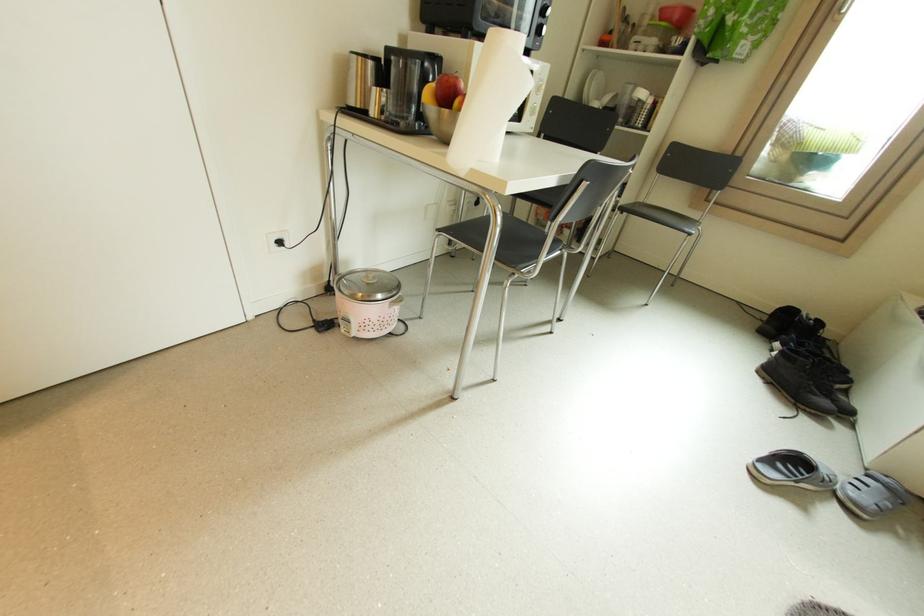
The width and height of the screenshot is (924, 616). I want to click on white power outlet, so click(276, 240).